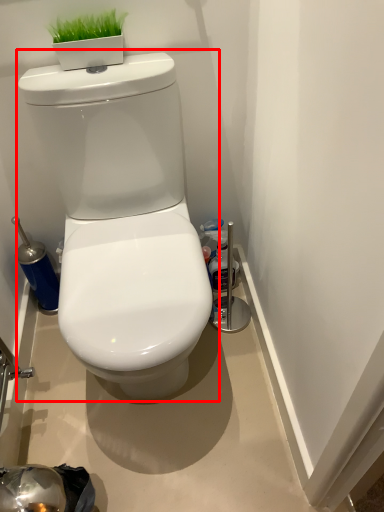
Question: From the image's perspective, where is toilet (annotated by the red box) located relative to bottle?

Choices:
 (A) below
 (B) above

Answer: (A)